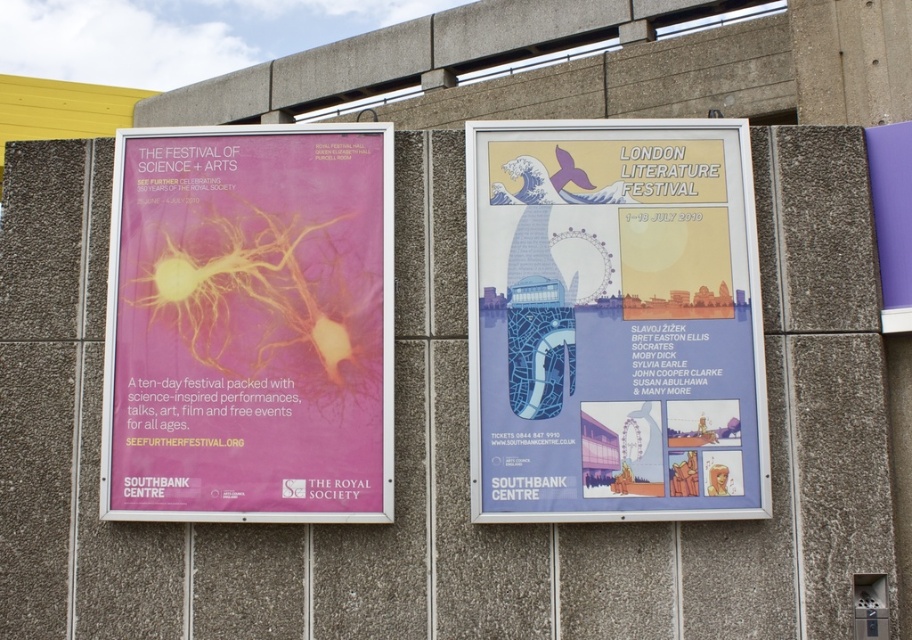
Is matte blue poster at center to the right of matte pink poster at left from the viewer's perspective?

Yes, matte blue poster at center is to the right of matte pink poster at left.

Does matte blue poster at center appear over matte pink poster at left?

Yes, matte blue poster at center is above matte pink poster at left.

Locate an element on the screen. This screenshot has width=912, height=640. matte blue poster at center is located at coordinates (614, 321).